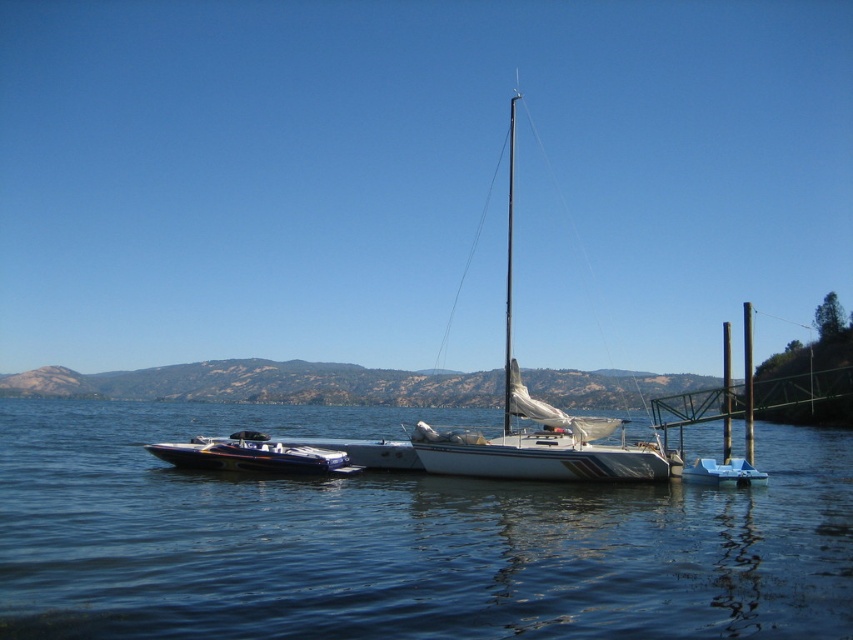
You are standing on the pier and want to take a photo of the white matte sailboat at center. If your camera has a maximum focus range of 70 feet, will it be able to capture the boat clearly?

The white matte sailboat at center and camera are 69.10 feet apart from each other, which is within the camera maximum focus range of 70 feet. So, the camera can capture the boat clearly.

You are planning to store the glossy blue boat at lower left and the blue plastic boat at lower right in a storage unit. The storage unit has a height limit of 2 meters. Can both boats fit vertically without being disassembled?

The glossy blue boat at lower left is much taller than the blue plastic boat at lower right. Since the storage unit has a height limit of 2 meters, only the blue plastic boat at lower right can fit vertically. The glossy blue boat at lower left exceeds the height limit and cannot be stored vertically without disassembly.

You are standing on the pier and want to know the exact coordinates of the clear water at center. What are the coordinates?

The clear water at center is located at coordinates point (399, 538).